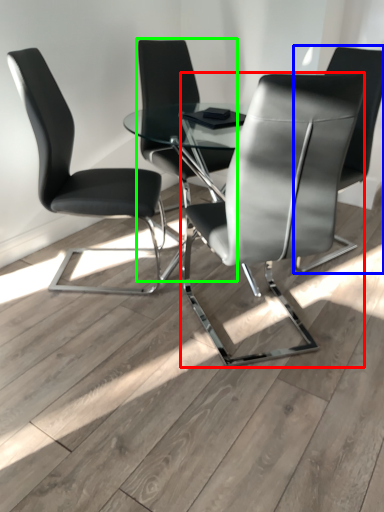
Question: Estimate the real-world distances between objects in this image. Which object is farther from chair (highlighted by a red box), chair (highlighted by a blue box) or chair (highlighted by a green box)?

Choices:
 (A) chair
 (B) chair

Answer: (B)